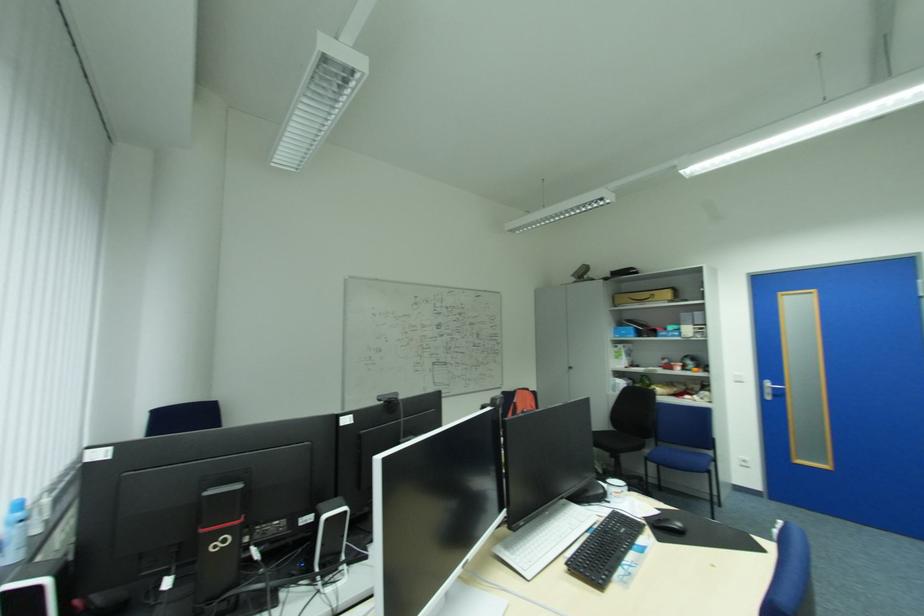
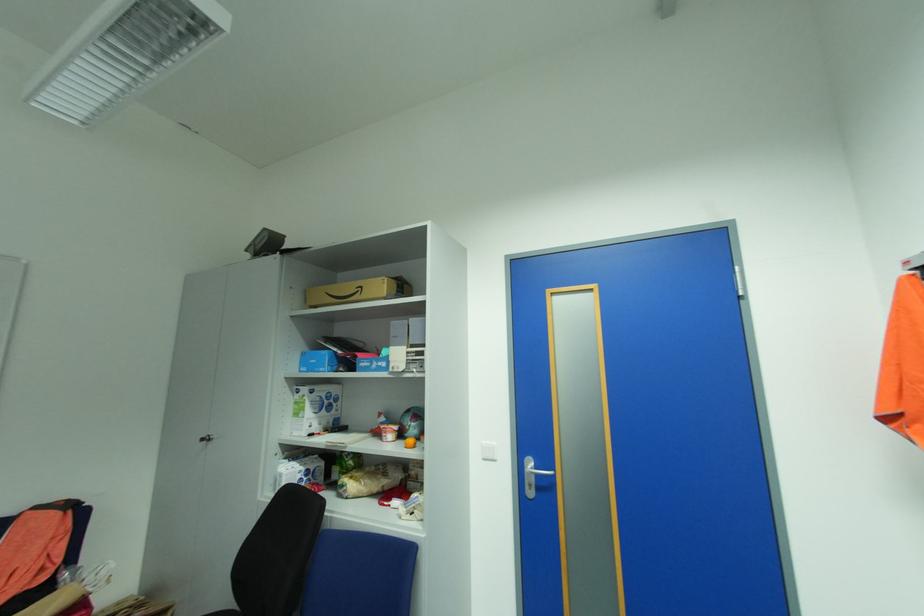
Where in the second image is the point corresponding to (x=636, y=336) from the first image?

(327, 370)